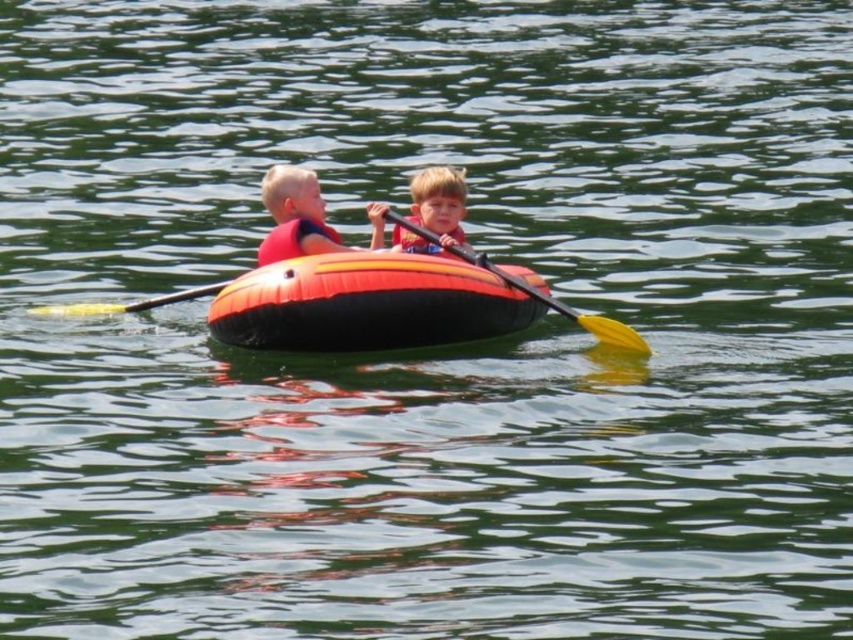
Consider the image. You are a safety inspector checking the equipment on the orange and black inflatable tube. You notice the yellow plastic paddle at center and the matte blue life jacket at center. Which item is positioned closer to the front of the tube?

The yellow plastic paddle at center is closer to the viewer than the matte blue life jacket at center, so the paddle is positioned closer to the front of the tube.

You are a lifeguard observing the scene. Where is the matte red life vest at center located in terms of coordinates?

The matte red life vest at center is located at coordinates point [294,216].

You are a photographer trying to capture the two children in the orange and black tube. You notice two specific points marked on your camera screen at coordinates point (459, 244) and point (433, 243). Which point is closer to the camera lens?

Point (459, 244) is further to the viewer than point (433, 243), so the point closer to the camera lens is point (433, 243).